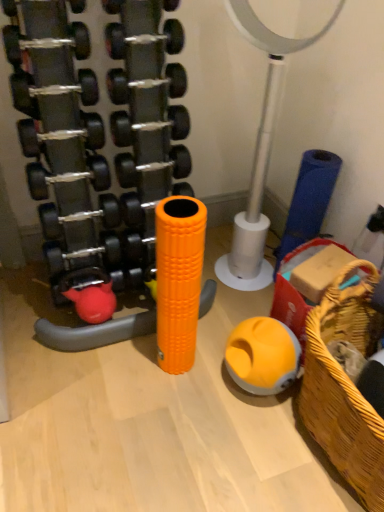
Question: Which direction should I rotate to look at rubberized yellow ball at center, which ranks as the 1th toy in right-to-left order, — up or down?

Choices:
 (A) down
 (B) up

Answer: (A)

Question: Is rubberized yellow ball at center, which appears as the second toy when viewed from the left, far away from woven wood basket at lower right?

Choices:
 (A) yes
 (B) no

Answer: (B)

Question: Can you confirm if rubberized yellow ball at center, which ranks as the 1th toy in right-to-left order, is smaller than woven wood basket at lower right?

Choices:
 (A) yes
 (B) no

Answer: (A)

Question: Does rubberized yellow ball at center, which appears as the second toy when viewed from the left, have a lesser height compared to woven wood basket at lower right?

Choices:
 (A) yes
 (B) no

Answer: (A)

Question: From a real-world perspective, is rubberized yellow ball at center, which ranks as the 1th toy in right-to-left order, located higher than woven wood basket at lower right?

Choices:
 (A) no
 (B) yes

Answer: (A)

Question: Is rubberized yellow ball at center, which appears as the second toy when viewed from the left, aimed at woven wood basket at lower right?

Choices:
 (A) yes
 (B) no

Answer: (B)

Question: Can we say rubberized yellow ball at center, which appears as the second toy when viewed from the left, lies outside woven wood basket at lower right?

Choices:
 (A) yes
 (B) no

Answer: (A)

Question: Can you confirm if rubberized yellow ball at center, which ranks as the 1th toy in right-to-left order, is smaller than metallic silver basketball hoop at center?

Choices:
 (A) yes
 (B) no

Answer: (A)

Question: Does rubberized yellow ball at center, which ranks as the 1th toy in right-to-left order, have a greater width compared to metallic silver basketball hoop at center?

Choices:
 (A) yes
 (B) no

Answer: (B)

Question: Is rubberized yellow ball at center, which ranks as the 1th toy in right-to-left order, completely or partially outside of metallic silver basketball hoop at center?

Choices:
 (A) yes
 (B) no

Answer: (A)

Question: Considering the relative sizes of rubberized yellow ball at center, which appears as the second toy when viewed from the left, and metallic silver basketball hoop at center in the image provided, is rubberized yellow ball at center, which appears as the second toy when viewed from the left, taller than metallic silver basketball hoop at center?

Choices:
 (A) yes
 (B) no

Answer: (B)

Question: Is the position of rubberized yellow ball at center, which appears as the second toy when viewed from the left, less distant than that of metallic silver basketball hoop at center?

Choices:
 (A) no
 (B) yes

Answer: (A)

Question: From a real-world perspective, is rubberized yellow ball at center, which ranks as the 1th toy in right-to-left order, beneath metallic silver basketball hoop at center?

Choices:
 (A) no
 (B) yes

Answer: (B)

Question: Would you say woven wood basket at lower right contains orange foam roller at center, marked as the first toy in a left-to-right arrangement?

Choices:
 (A) no
 (B) yes

Answer: (A)